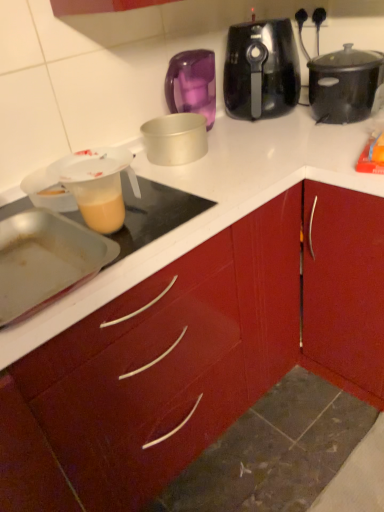
Question: Which direction should I rotate to look at black plastic slow cooker at upper center, marked as the second slow cooker in a right-to-left arrangement?

Choices:
 (A) left
 (B) right

Answer: (B)

Question: Would you say translucent plastic measuring cup at left, the 2th kitchen appliance positioned from the top, is part of glossy wood cabinet at center's contents?

Choices:
 (A) no
 (B) yes

Answer: (A)

Question: Is glossy wood cabinet at center positioned before translucent plastic measuring cup at left, the 2th kitchen appliance positioned from the top?

Choices:
 (A) yes
 (B) no

Answer: (A)

Question: Does glossy wood cabinet at center have a smaller size compared to translucent plastic measuring cup at left, the 2th kitchen appliance in the back-to-front sequence?

Choices:
 (A) no
 (B) yes

Answer: (A)

Question: Does glossy wood cabinet at center have a greater height compared to translucent plastic measuring cup at left, the 2th kitchen appliance positioned from the bottom?

Choices:
 (A) no
 (B) yes

Answer: (B)

Question: From a real-world perspective, is glossy wood cabinet at center under translucent plastic measuring cup at left, the 2th kitchen appliance positioned from the top?

Choices:
 (A) no
 (B) yes

Answer: (B)

Question: Does glossy wood cabinet at center appear on the left side of translucent plastic measuring cup at left, the 2th kitchen appliance in the back-to-front sequence?

Choices:
 (A) no
 (B) yes

Answer: (A)

Question: Is black plastic slow cooker at upper center, acting as the 1th slow cooker starting from the left, wider than metallic silver baking pan at left, the 3th kitchen appliance in the top-to-bottom sequence?

Choices:
 (A) yes
 (B) no

Answer: (B)

Question: From a real-world perspective, is black plastic slow cooker at upper center, acting as the 1th slow cooker starting from the left, on metallic silver baking pan at left, the 3th kitchen appliance when ordered from back to front?

Choices:
 (A) no
 (B) yes

Answer: (B)

Question: Is black plastic slow cooker at upper center, marked as the second slow cooker in a right-to-left arrangement, placed right next to metallic silver baking pan at left, which is counted as the first kitchen appliance, starting from the front?

Choices:
 (A) yes
 (B) no

Answer: (B)

Question: Does black plastic slow cooker at upper center, marked as the second slow cooker in a right-to-left arrangement, turn towards metallic silver baking pan at left, which is counted as the first kitchen appliance, starting from the front?

Choices:
 (A) yes
 (B) no

Answer: (B)

Question: Is black plastic slow cooker at upper center, acting as the 1th slow cooker starting from the left, outside of metallic silver baking pan at left, the 3th kitchen appliance when ordered from back to front?

Choices:
 (A) no
 (B) yes

Answer: (B)

Question: Is black plastic slow cooker at upper center, marked as the second slow cooker in a right-to-left arrangement, positioned behind metallic silver baking pan at left, the 1th kitchen appliance ordered from the bottom?

Choices:
 (A) no
 (B) yes

Answer: (B)

Question: Does black matte slow cooker at upper right, which appears as the first slow cooker when viewed from the right, appear on the left side of black plastic slow cooker at upper center, acting as the 1th slow cooker starting from the left?

Choices:
 (A) no
 (B) yes

Answer: (A)